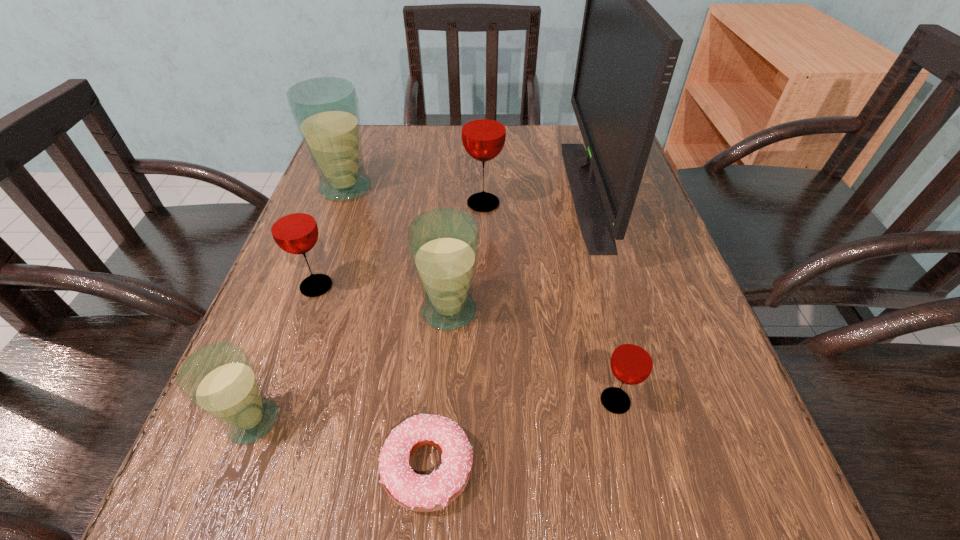
Locate an element on the screen. free space located on the right of the nearest red glass is located at coordinates (675, 401).

Where is `vacant space located 0.330m on the right of the nearest blue glass`? This screenshot has height=540, width=960. vacant space located 0.330m on the right of the nearest blue glass is located at coordinates (517, 421).

You are a GUI agent. You are given a task and a screenshot of the screen. Output one action in this format:
    pyautogui.click(x=<x>, y=<y>)
    Task: Click on the vacant space located 0.120m on the right of the doughnut
    Image resolution: width=960 pixels, height=540 pixels.
    Given the screenshot: What is the action you would take?
    pyautogui.click(x=566, y=467)

Where is `monitor situated at the far edge`? monitor situated at the far edge is located at coordinates (627, 54).

This screenshot has height=540, width=960. What are the coordinates of `glass present at the far edge` in the screenshot? It's located at (326, 112).

The width and height of the screenshot is (960, 540). What are the coordinates of `object that is at the near edge` in the screenshot? It's located at (422, 493).

In order to click on monitor positioned at the right edge in this screenshot , I will do `click(627, 54)`.

This screenshot has height=540, width=960. I want to click on glass at the right edge, so [632, 361].

Where is `object situated at the far left corner`? The image size is (960, 540). object situated at the far left corner is located at coordinates (326, 112).

Identify the location of object situated at the far right corner. Image resolution: width=960 pixels, height=540 pixels. (627, 54).